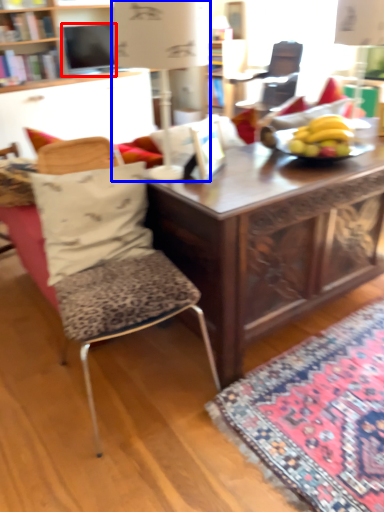
Question: Which object appears farthest to the camera in this image, television (highlighted by a red box) or table lamp (highlighted by a blue box)?

Choices:
 (A) television
 (B) table lamp

Answer: (A)